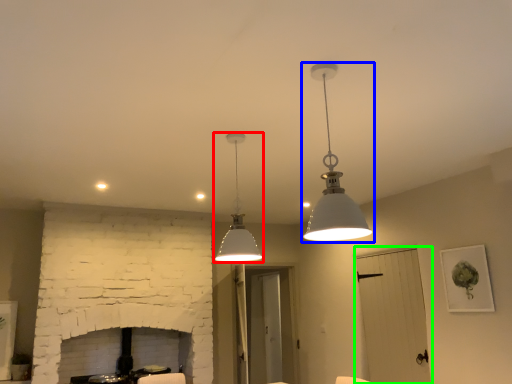
Question: Which object is the farthest from lamp (highlighted by a red box)? Choose among these: lamp (highlighted by a blue box) or glass door (highlighted by a green box).

Choices:
 (A) lamp
 (B) glass door

Answer: (B)